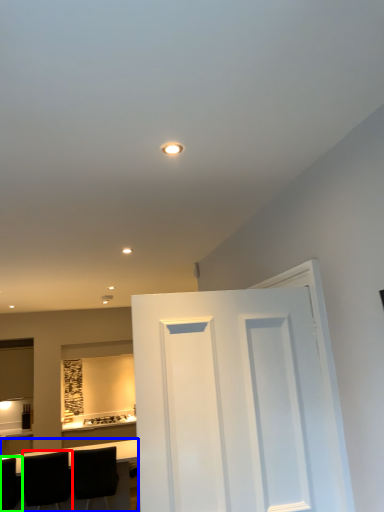
Question: Which object is positioned farthest from chair (highlighted by a red box)? Select from table (highlighted by a blue box) and chair (highlighted by a green box).

Choices:
 (A) table
 (B) chair

Answer: (A)